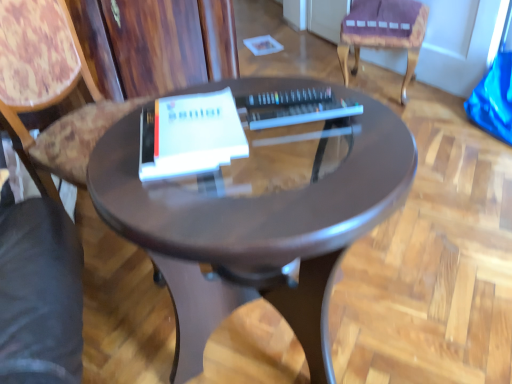
In order to click on free point below glossy brown table at center (from a real-world perspective) in this screenshot , I will do [x=289, y=347].